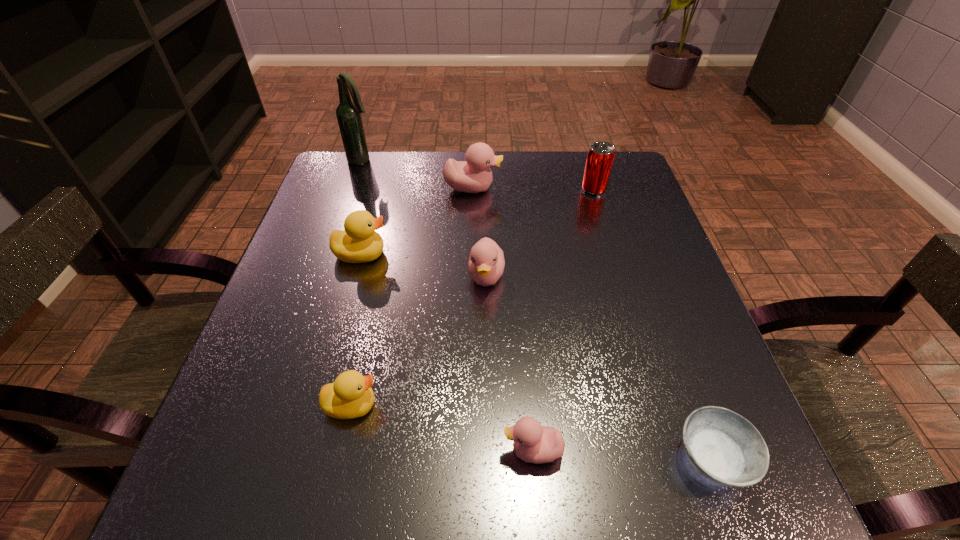
Locate an element on the screen. object that is at the far left corner is located at coordinates (348, 113).

I want to click on object located at the far right corner, so click(x=600, y=157).

Locate an element on the screen. This screenshot has width=960, height=540. object that is at the near right corner is located at coordinates (724, 447).

At what (x,y) coordinates should I click in order to perform the action: click on vacant space at the far edge of the desktop. Please return your answer as a coordinate pair (x, y). This screenshot has width=960, height=540. Looking at the image, I should click on (559, 182).

Locate an element on the screen. The image size is (960, 540). vacant space at the left edge is located at coordinates (346, 312).

Locate an element on the screen. This screenshot has width=960, height=540. vacant area at the right edge of the desktop is located at coordinates pyautogui.click(x=636, y=209).

Find the location of `free space at the far left corner of the desktop`. free space at the far left corner of the desktop is located at coordinates (364, 191).

In the image, there is a desktop. Identify the location of vacant space at the near left corner. This screenshot has width=960, height=540. (273, 478).

You are a GUI agent. You are given a task and a screenshot of the screen. Output one action in this format:
    pyautogui.click(x=<x>, y=<y>)
    Task: Click on the vacant region at the far right corner of the desktop
    Image resolution: width=960 pixels, height=540 pixels.
    Given the screenshot: What is the action you would take?
    pyautogui.click(x=613, y=187)

Locate an element on the screen. The width and height of the screenshot is (960, 540). vacant space that's between the second nearest pink duckling and the shortest object is located at coordinates (599, 367).